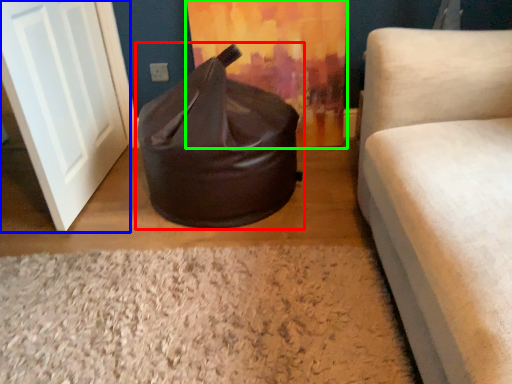
Question: Considering the real-world distances, which object is closest to bean bag chair (highlighted by a red box)? door (highlighted by a blue box) or curtain (highlighted by a green box).

Choices:
 (A) door
 (B) curtain

Answer: (B)